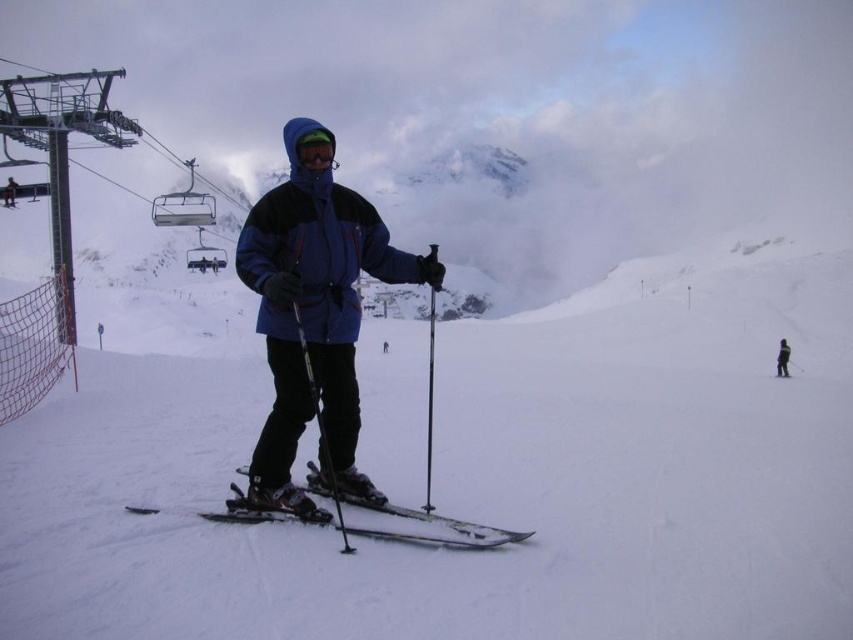
Question: Which point appears farthest from the camera in this image?

Choices:
 (A) (785, 372)
 (B) (416, 344)
 (C) (345, 529)
 (D) (527, 531)

Answer: (B)

Question: Among these objects, which one is farthest from the camera?

Choices:
 (A) blue matte jacket at center
 (B) metallic skis at center
 (C) white matte snow at center

Answer: (A)

Question: Is metallic skis at center positioned in front of matte blue jacket at center?

Choices:
 (A) no
 (B) yes

Answer: (B)

Question: Which of the following is the closest to the observer?

Choices:
 (A) transparent blue goggles at center
 (B) matte blue jacket at center
 (C) blue matte jacket at center

Answer: (C)

Question: Considering the relative positions of metallic ski pole at center and dark gray ski pants at center in the image provided, where is metallic ski pole at center located with respect to dark gray ski pants at center?

Choices:
 (A) above
 (B) below

Answer: (A)

Question: Does transparent blue goggles at center have a lesser width compared to dark gray ski pants at center?

Choices:
 (A) no
 (B) yes

Answer: (B)